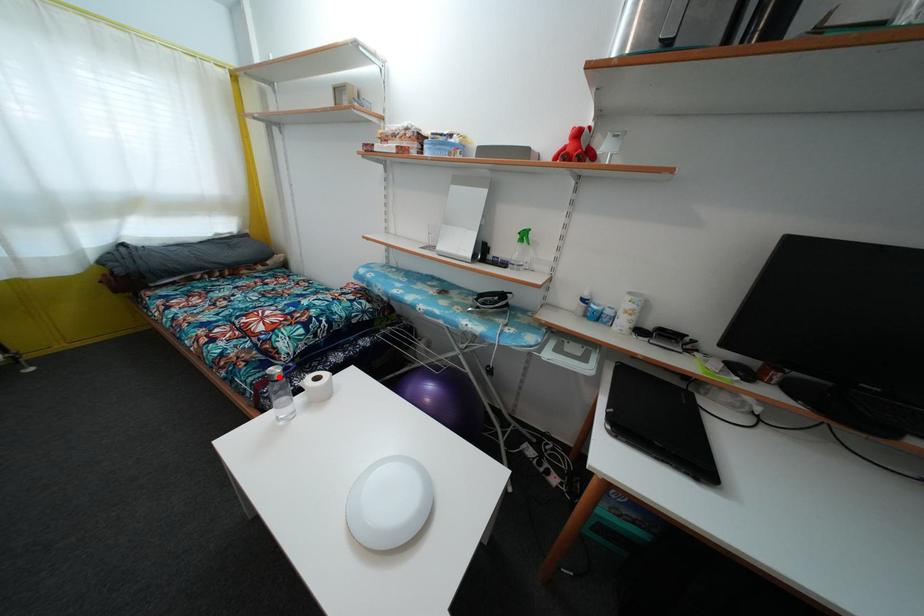
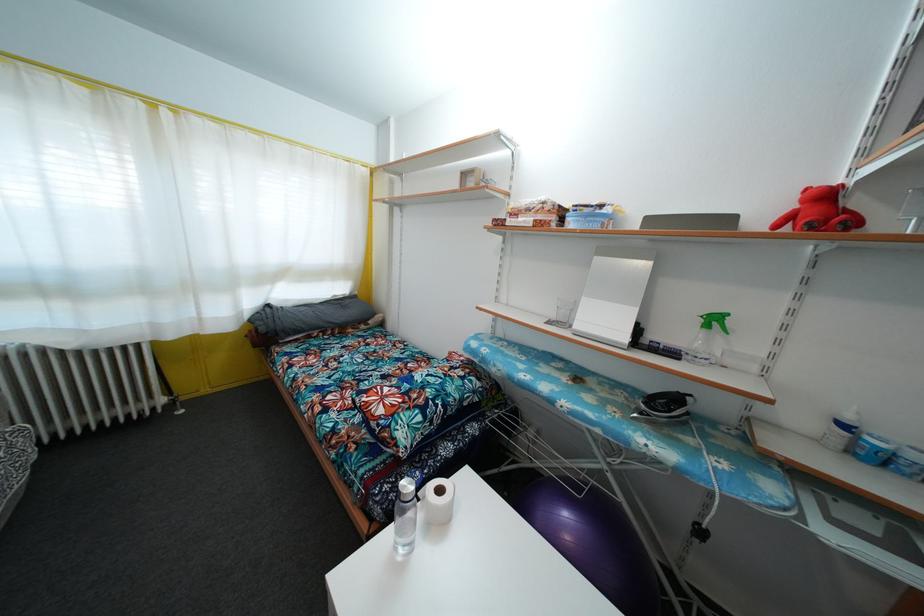
Question: I am providing you with two images of the same scene from different viewpoints. Image1 has a red point marked. In image2, the corresponding 3D location appears at what relative position? Reply with the corresponding letter.

Choices:
 (A) Closer
 (B) Farther

Answer: (A)